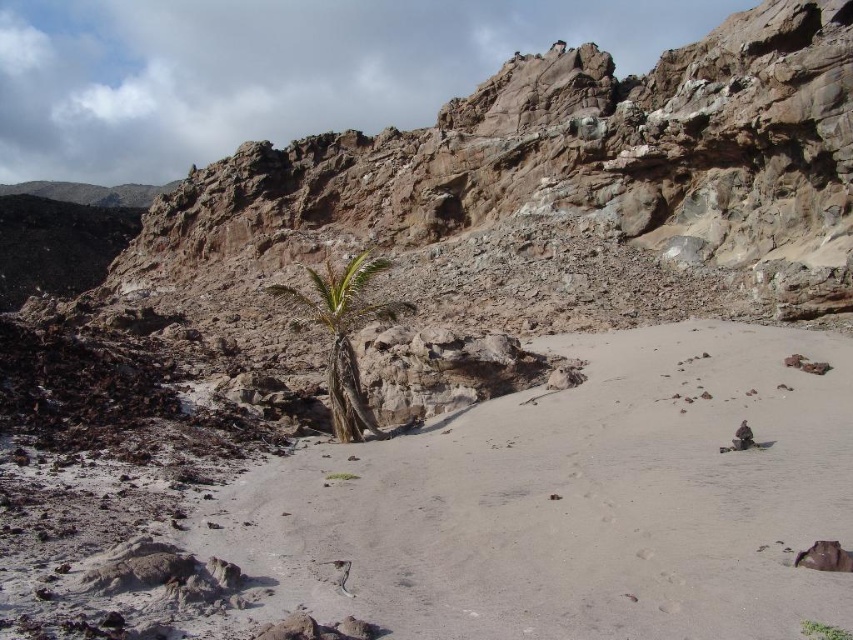
Question: Is white sandy beach at center further to camera compared to green leafy plant at center?

Choices:
 (A) no
 (B) yes

Answer: (B)

Question: Can you confirm if white sandy beach at center is positioned to the left of green leafy palm tree at center?

Choices:
 (A) no
 (B) yes

Answer: (A)

Question: Which object is the closest to the green leafy plant at center?

Choices:
 (A) white sandy beach at center
 (B) green leafy palm tree at center

Answer: (A)

Question: Is green leafy palm tree at center bigger than green leafy plant at center?

Choices:
 (A) no
 (B) yes

Answer: (B)

Question: Which object is the closest to the green leafy plant at center?

Choices:
 (A) white sandy beach at center
 (B) green leafy palm tree at center

Answer: (A)

Question: Which point is closer to the camera?

Choices:
 (A) green leafy palm tree at center
 (B) white sandy beach at center

Answer: (B)